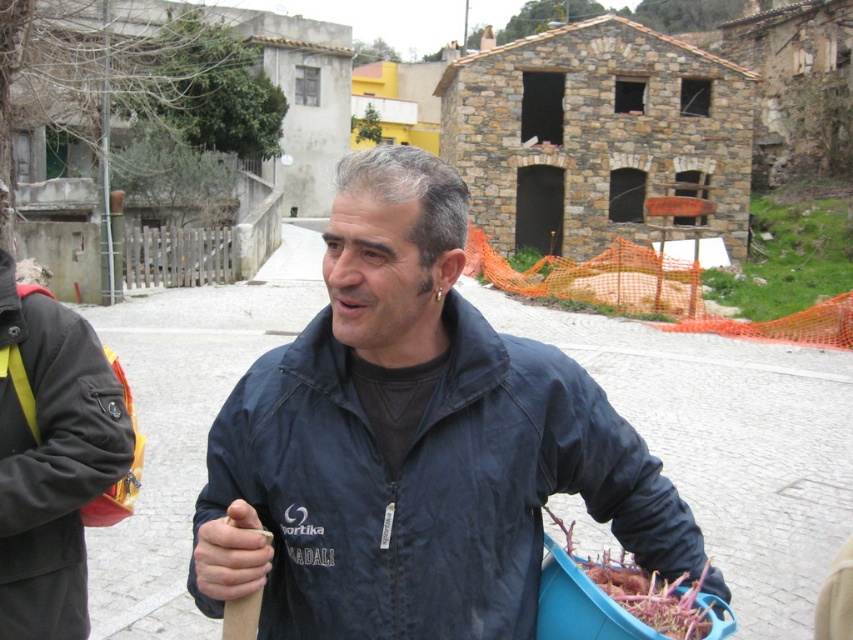
Question: Which point is farther from the camera taking this photo?

Choices:
 (A) (682, 625)
 (B) (683, 522)
 (C) (91, 355)

Answer: (C)

Question: Estimate the real-world distances between objects in this image. Which object is closer to the black fleece jacket at left?

Choices:
 (A) brown fibrous roots at lower center
 (B) dark blue jacket at center

Answer: (B)

Question: From the image, what is the correct spatial relationship of black fleece jacket at left in relation to brown fibrous roots at lower center?

Choices:
 (A) above
 (B) below

Answer: (A)

Question: Which point is farther to the camera?

Choices:
 (A) (674, 596)
 (B) (456, 442)

Answer: (B)

Question: Can you confirm if dark blue jacket at center is bigger than brown fibrous roots at lower center?

Choices:
 (A) yes
 (B) no

Answer: (A)

Question: Is dark blue jacket at center closer to the viewer compared to brown fibrous roots at lower center?

Choices:
 (A) yes
 (B) no

Answer: (A)